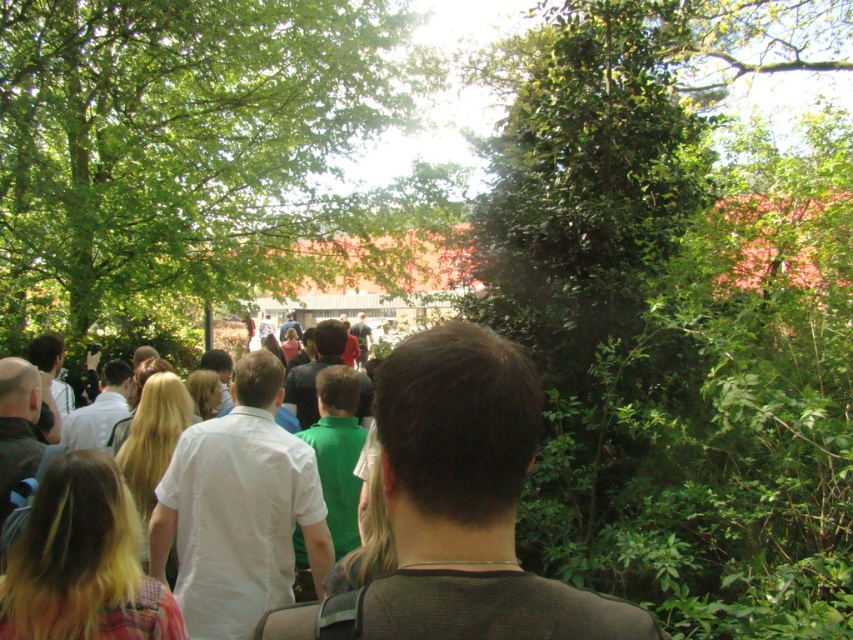
Looking at this image, can you confirm if white shirt at center is taller than white cotton shirt at center?

No, white shirt at center is not taller than white cotton shirt at center.

Between point (305, 552) and point (263, 545), which one is positioned behind?

Positioned behind is point (305, 552).

Who is more distant from viewer, (x=293, y=458) or (x=311, y=566)?

The point (x=311, y=566) is behind.

Identify the location of white shirt at center. The width and height of the screenshot is (853, 640). (248, 508).

Is point (198, 262) less distant than point (195, 493)?

No, (198, 262) is behind (195, 493).

Is green leafy tree at center further to the viewer compared to white cotton shirt at center?

Yes.

Describe the element at coordinates (195, 157) in the screenshot. I see `green leafy tree at center` at that location.

The height and width of the screenshot is (640, 853). What are the coordinates of `green leafy tree at center` in the screenshot? It's located at (195, 157).

Is green leafy tree at center to the left of white shirt at center from the viewer's perspective?

Yes, green leafy tree at center is to the left of white shirt at center.

Who is more distant from viewer, (262, 108) or (241, 481)?

Positioned behind is point (262, 108).

Find the location of `green leafy tree at center`. green leafy tree at center is located at coordinates (195, 157).